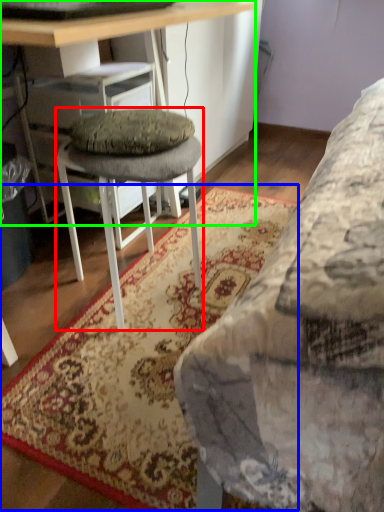
Question: Estimate the real-world distances between objects in this image. Which object is farther from stool (highlighted by a red box), mat (highlighted by a blue box) or desk (highlighted by a green box)?

Choices:
 (A) mat
 (B) desk

Answer: (B)